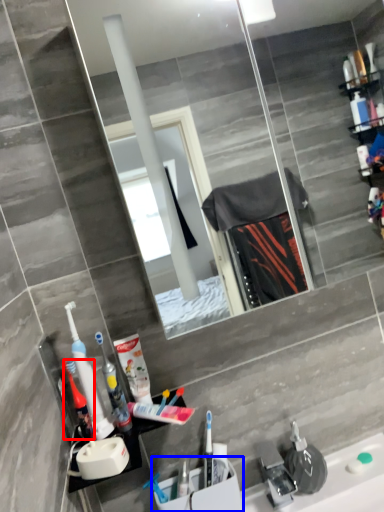
Question: Which point is closer to the camera, mouthwash (highlighted by a red box) or sink (highlighted by a blue box)?

Choices:
 (A) mouthwash
 (B) sink

Answer: (A)